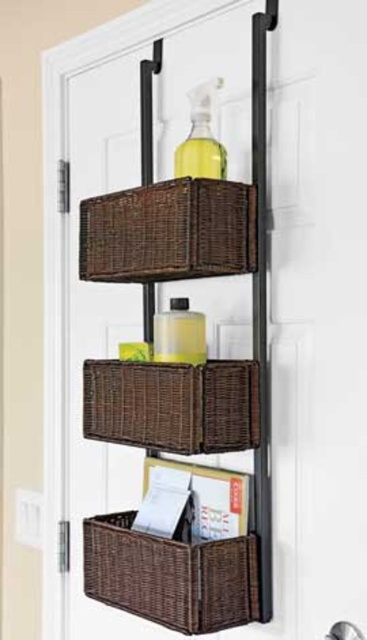
Question: Does brown wicker baskets at center appear on the right side of woven brown basket at lower center?

Choices:
 (A) yes
 (B) no

Answer: (B)

Question: Estimate the real-world distances between objects in this image. Which object is farther from the woven brown basket at center?

Choices:
 (A) woven brown basket at lower center
 (B) brown wicker basket at center

Answer: (B)

Question: Which of these objects is positioned farthest from the brown wicker baskets at center?

Choices:
 (A) woven brown basket at lower center
 (B) brown wicker basket at center

Answer: (A)

Question: Among these points, which one is nearest to the camera?

Choices:
 (A) (176, 620)
 (B) (180, 397)
 (C) (235, 246)

Answer: (B)

Question: Observing the image, what is the correct spatial positioning of brown wicker basket at center in reference to woven brown basket at lower center?

Choices:
 (A) below
 (B) above

Answer: (B)

Question: Can you confirm if brown wicker basket at center is positioned above woven brown basket at lower center?

Choices:
 (A) no
 (B) yes

Answer: (B)